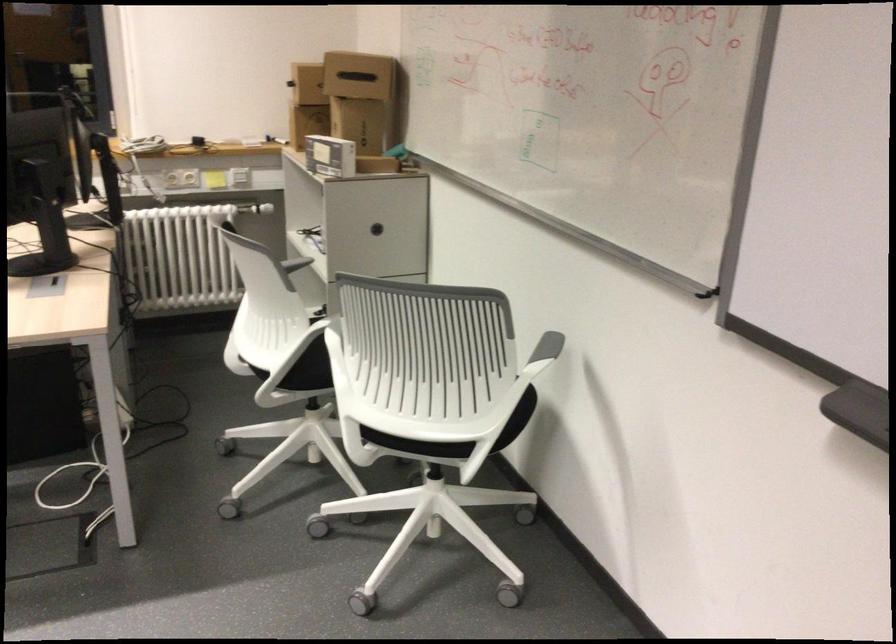
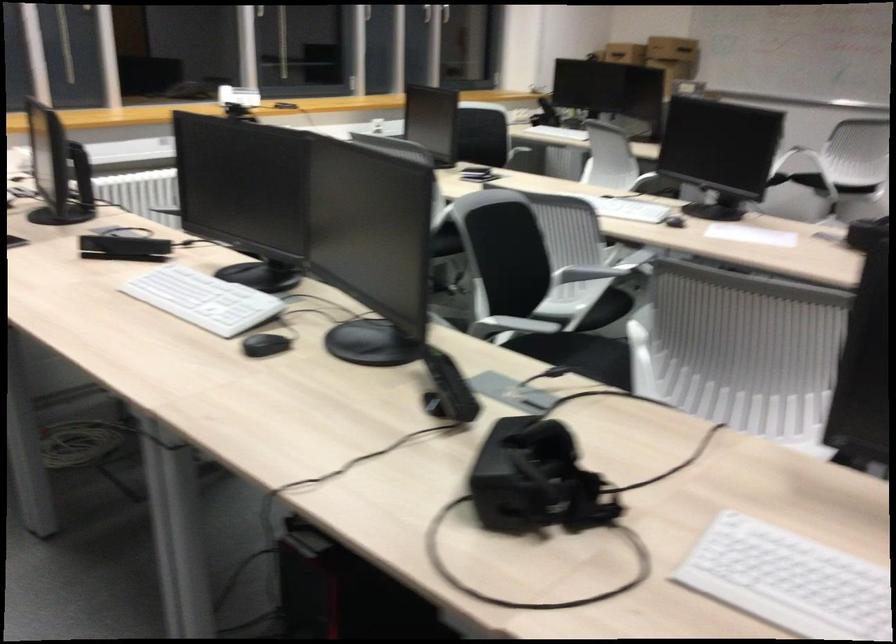
Question: I am providing you with two images of the same scene from different viewpoints. Please identify which objects are invisible in image2.

Choices:
 (A) black VR headset
 (B) small white box
 (C) onion
 (D) black computer mouse

Answer: (B)